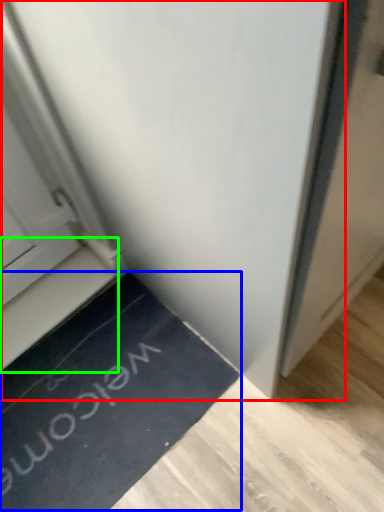
Question: Which object is positioned farthest from door (highlighted by a red box)? Select from doormat (highlighted by a blue box) and stairwell (highlighted by a green box).

Choices:
 (A) doormat
 (B) stairwell

Answer: (A)